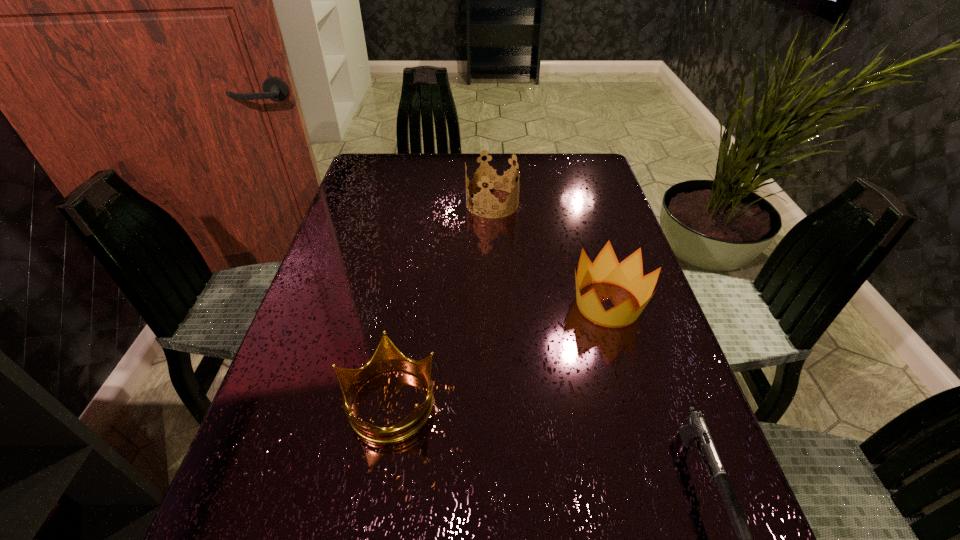
Where is `the second crown from right to left`? This screenshot has width=960, height=540. the second crown from right to left is located at coordinates (492, 176).

This screenshot has width=960, height=540. In order to click on the third object from right to left in this screenshot , I will do `click(492, 176)`.

Find the location of a particular element. The image size is (960, 540). the third nearest object is located at coordinates (628, 274).

Identify the location of the rightmost crown. The width and height of the screenshot is (960, 540). (628, 274).

You are a GUI agent. You are given a task and a screenshot of the screen. Output one action in this format:
    pyautogui.click(x=<x>, y=<y>)
    Task: Click on the leftmost crown
    
    Given the screenshot: What is the action you would take?
    pyautogui.click(x=387, y=357)

You are a GUI agent. You are given a task and a screenshot of the screen. Output one action in this format:
    pyautogui.click(x=<x>, y=<y>)
    Task: Click on the leftmost object
    This screenshot has height=540, width=960.
    Given the screenshot: What is the action you would take?
    pyautogui.click(x=387, y=357)

This screenshot has height=540, width=960. Find the location of `free point located 0.190m on the front of the second crown from left to right`. free point located 0.190m on the front of the second crown from left to right is located at coordinates (494, 263).

This screenshot has height=540, width=960. In order to click on free space located on the left of the second farthest crown in this screenshot , I will do `click(506, 304)`.

Where is `vacant point located 0.260m on the back of the leftmost object`? This screenshot has height=540, width=960. vacant point located 0.260m on the back of the leftmost object is located at coordinates (411, 274).

The height and width of the screenshot is (540, 960). What are the coordinates of `object that is positioned at the far edge` in the screenshot? It's located at (492, 176).